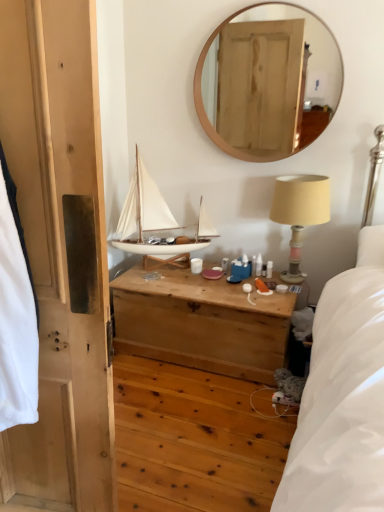
Find the location of a particular element. Image resolution: width=384 pixels, height=512 pixels. free spot above wooden chest at center (from a real-world perspective) is located at coordinates (203, 279).